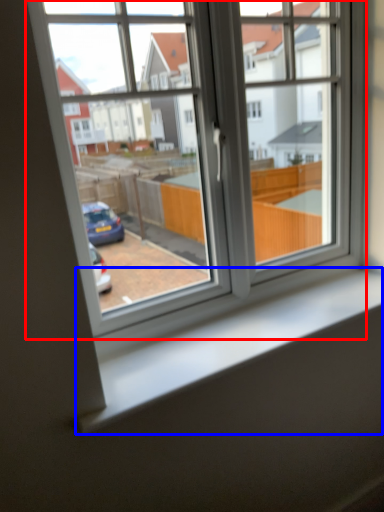
Question: Among these objects, which one is nearest to the camera, window (highlighted by a red box) or window sill (highlighted by a blue box)?

Choices:
 (A) window
 (B) window sill

Answer: (A)